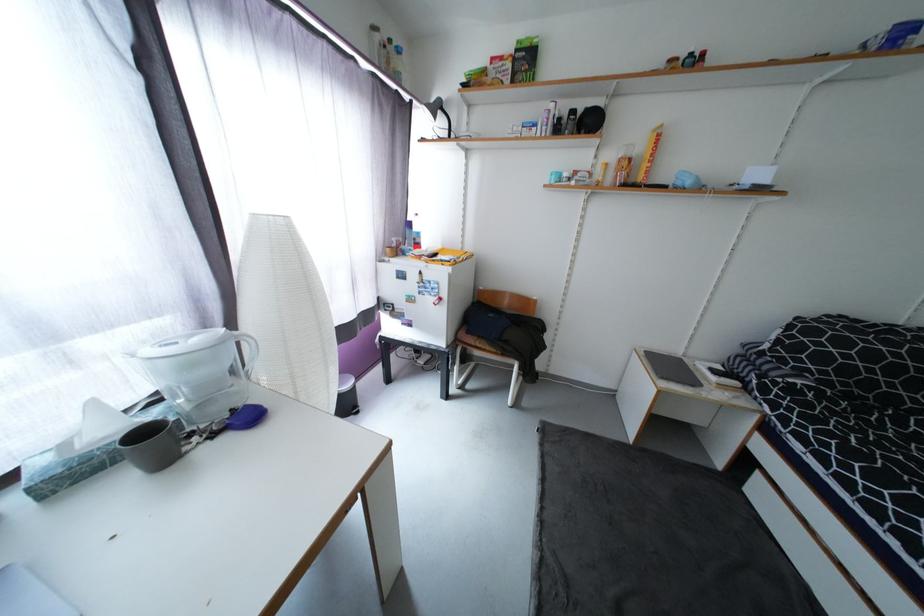
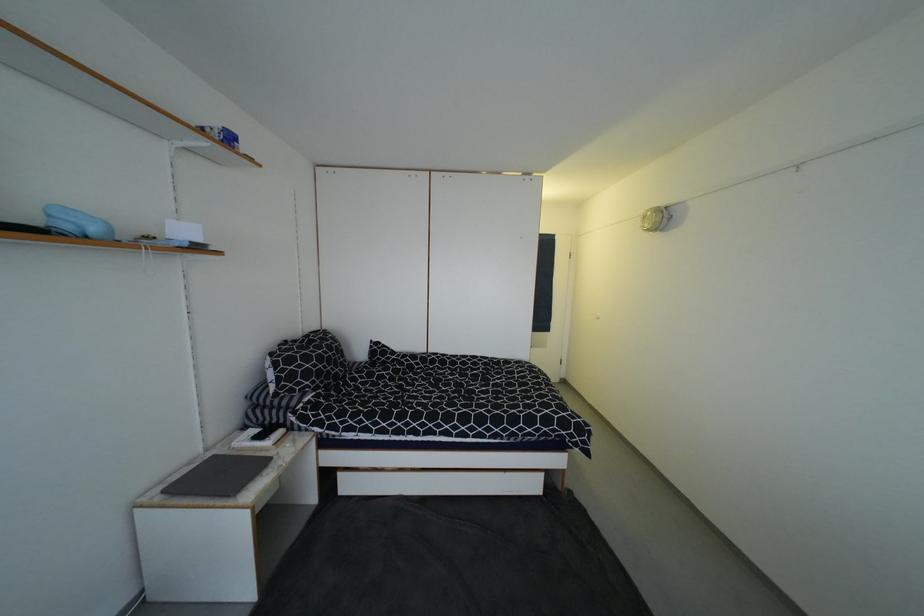
Question: I am providing you with two images of the same scene from different viewpoints. Which of the following objects are not visible in image2?

Choices:
 (A) blue tissue box
 (B) closed grey laptop
 (C) black remote control
 (D) none of these

Answer: (D)